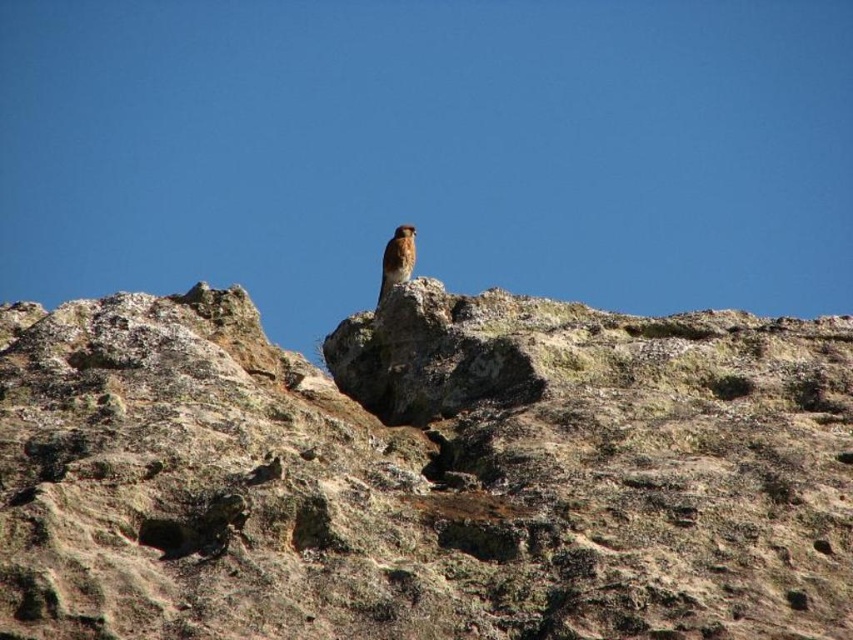
The image size is (853, 640). Identify the location of brown rough rock at upper center. (422, 472).

Is brown rough rock at upper center shorter than rusty brown feathers at center?

No.

Between point (166, 397) and point (387, 266), which one is positioned behind?

The point (387, 266) is more distant.

Identify the location of brown rough rock at upper center. Image resolution: width=853 pixels, height=640 pixels. (422, 472).